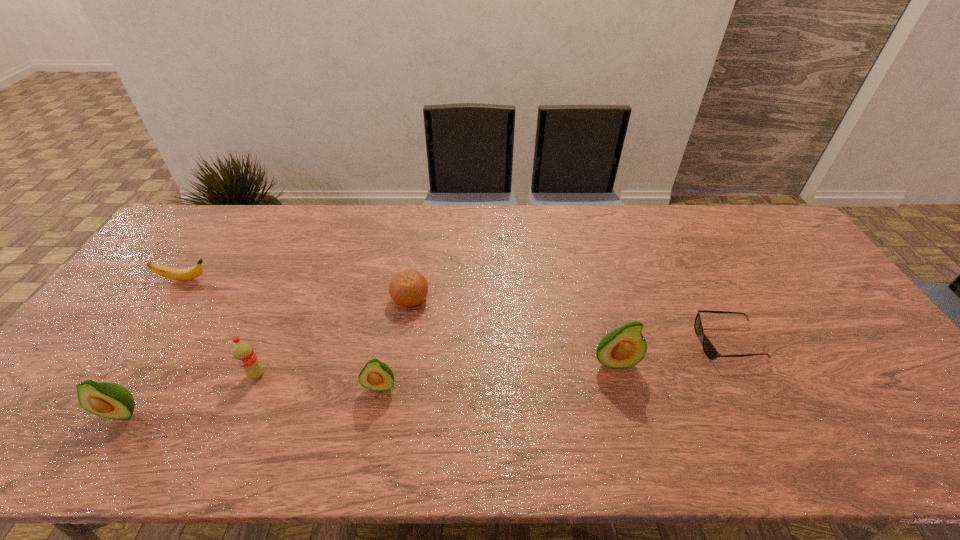
I want to click on the leftmost avocado, so click(x=108, y=400).

The height and width of the screenshot is (540, 960). Identify the location of the nearest object. (108, 400).

You are a GUI agent. You are given a task and a screenshot of the screen. Output one action in this format:
    pyautogui.click(x=<x>, y=<y>)
    Task: Click on the fourth shortest object
    
    Given the screenshot: What is the action you would take?
    click(377, 376)

At what (x,y) coordinates should I click in order to perform the action: click on the second avocado from right to left. Please return your answer as a coordinate pair (x, y). The height and width of the screenshot is (540, 960). Looking at the image, I should click on (377, 376).

Locate an element on the screen. the rightmost avocado is located at coordinates (624, 347).

Where is `the second object from right to left`? Image resolution: width=960 pixels, height=540 pixels. the second object from right to left is located at coordinates (624, 347).

The width and height of the screenshot is (960, 540). I want to click on the sixth nearest object, so click(x=409, y=288).

This screenshot has height=540, width=960. Identify the location of the farthest object. (187, 274).

Identify the location of the shortest object. This screenshot has height=540, width=960. (710, 351).

Find the location of a particular element. The height and width of the screenshot is (540, 960). sunglasses is located at coordinates (710, 351).